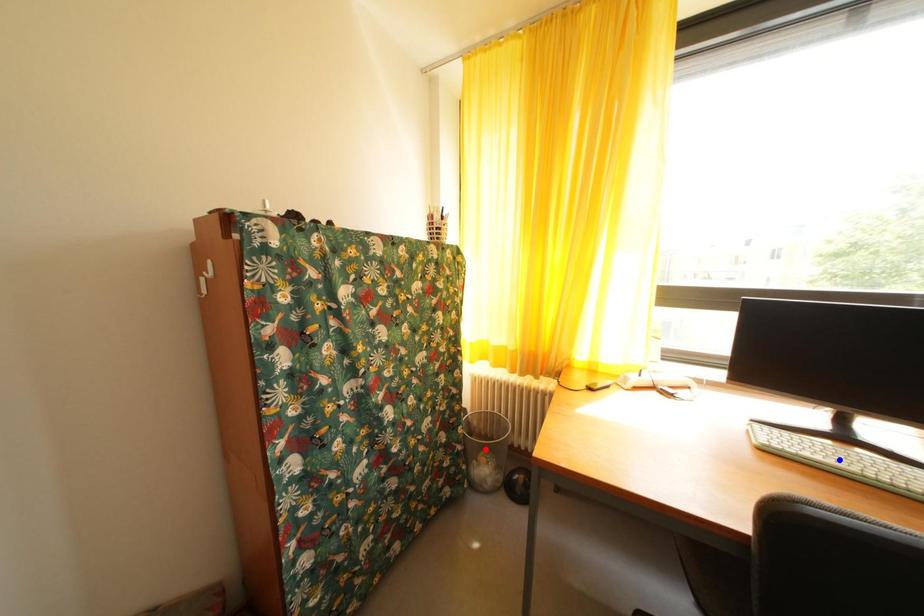
Question: Two points are marked on the image. Which point is closer to the camera?

Choices:
 (A) Blue point is closer.
 (B) Red point is closer.

Answer: (A)